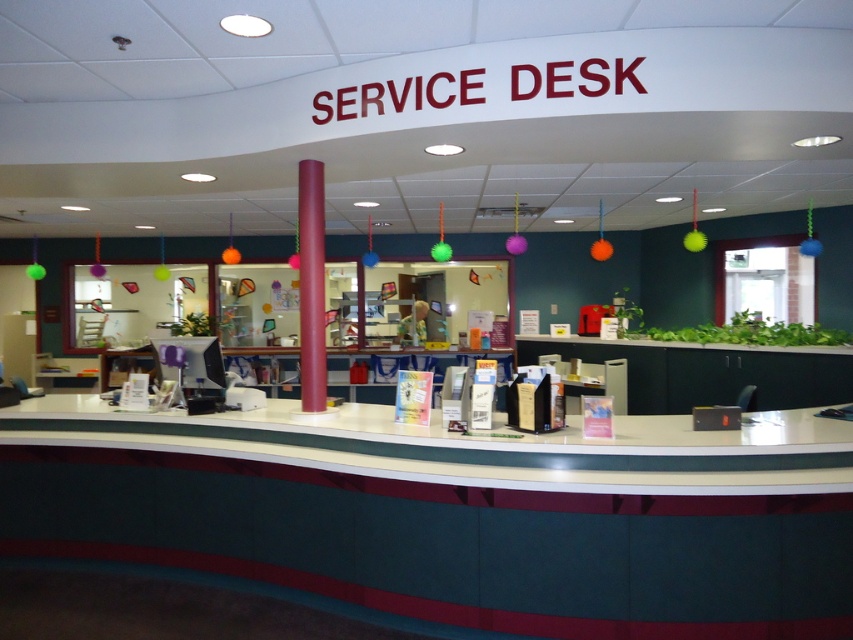
You are a customer standing in front of the counter. You want to place a folder on the green laminate desk at center so that it is directly above the matte plastic information desk at center. Is this possible?

Yes, because the green laminate desk at center is positioned over the matte plastic information desk at center, so placing the folder there would achieve the desired placement.

You are a customer at the service desk area. You need to hand over a form to the staff. Which object should you place the form on, the green laminate desk at center or the matte plastic information desk at center?

You should place the form on the matte plastic information desk at center because the green laminate desk at center is to the left of it, so the matte plastic information desk at center is likely the one where the staff is working.

Based on the photo, you are a customer standing in front of the service desk area. Which object, the green laminate desk at center or the matte plastic information desk at center, is closer to you?

The green laminate desk at center is closer to the viewer than the matte plastic information desk at center, so the green laminate desk at center is closer to you.